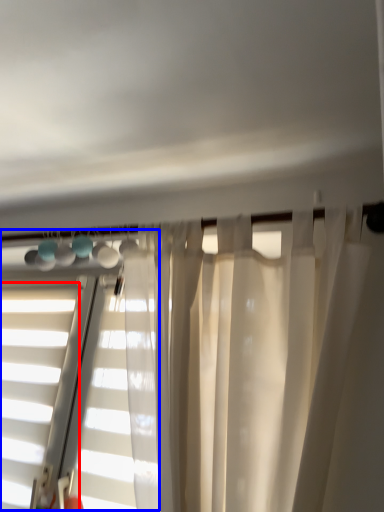
Question: Which object is further to the camera taking this photo, window (highlighted by a red box) or bay window (highlighted by a blue box)?

Choices:
 (A) window
 (B) bay window

Answer: (A)